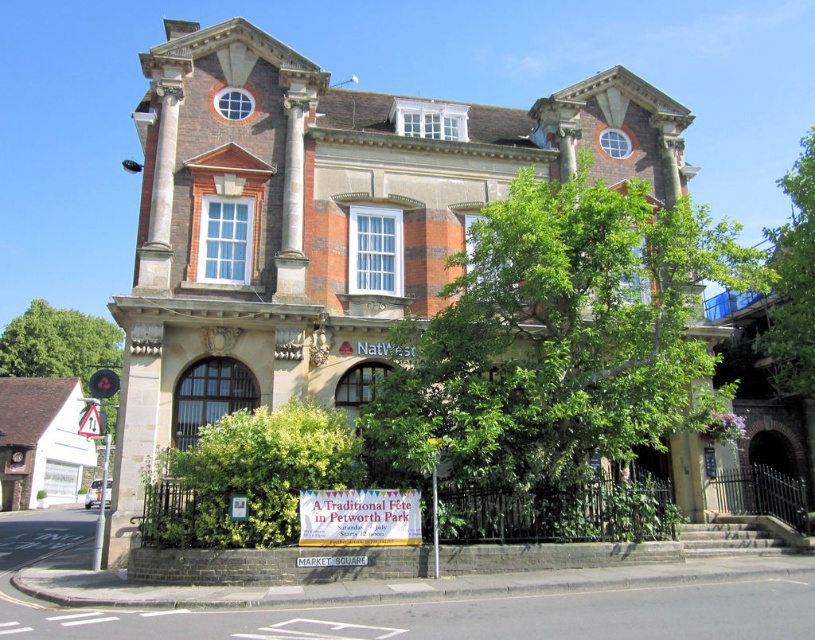
You are standing in front of the grand building and want to reach the entrance. There is a green leafy tree at left and a yellow plastic triangular at left. Which object should you move around to get a clear view of the entrance?

The green leafy tree at left is to the left of the yellow plastic triangular at left. To get a clear view of the entrance, you should move around the green leafy tree at left since it is closer to the left side and obscuring the view more than the yellow plastic triangular at left.

You are planning to set up a photo booth for the event mentioned on the signboard. The photo booth requires a space that is at least 40 meters wide. Based on the scene, can you determine if there is enough space between the green leafy tree at left and the yellow plastic triangular at left to accommodate the photo booth?

The distance between the green leafy tree at left and the yellow plastic triangular at left is 42.40 meters, which is more than the required 40 meters. Therefore, there is sufficient space to set up the photo booth between them.